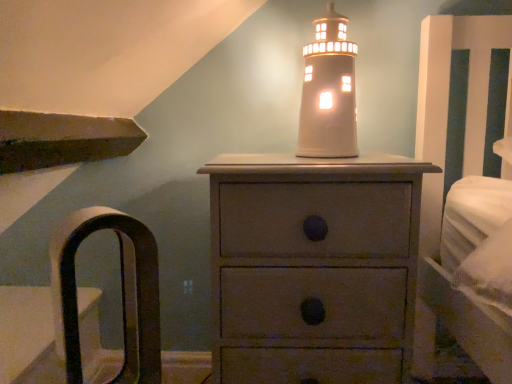
Question: From a real-world perspective, is white ceramic lighthouse at center physically located above or below matte gray chest of drawers at center?

Choices:
 (A) above
 (B) below

Answer: (A)

Question: Looking at their shapes, would you say white ceramic lighthouse at center is wider or thinner than matte gray chest of drawers at center?

Choices:
 (A) thin
 (B) wide

Answer: (A)

Question: Which is nearer to the brown leather armchair at left?

Choices:
 (A) matte gray chest of drawers at center
 (B) white ceramic lighthouse at center

Answer: (A)

Question: Which is farther from the white ceramic lighthouse at center?

Choices:
 (A) brown leather armchair at left
 (B) matte gray chest of drawers at center

Answer: (A)